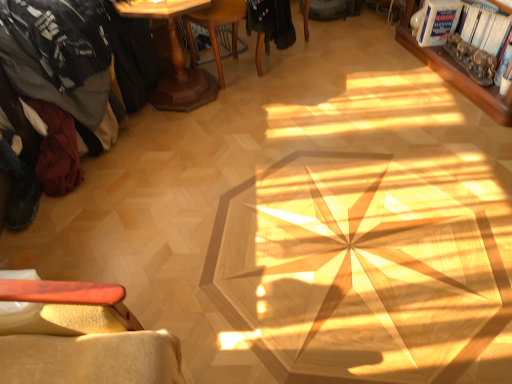
Where is `free spot in front of wooden pedestal table at upper left`? The width and height of the screenshot is (512, 384). free spot in front of wooden pedestal table at upper left is located at coordinates (192, 140).